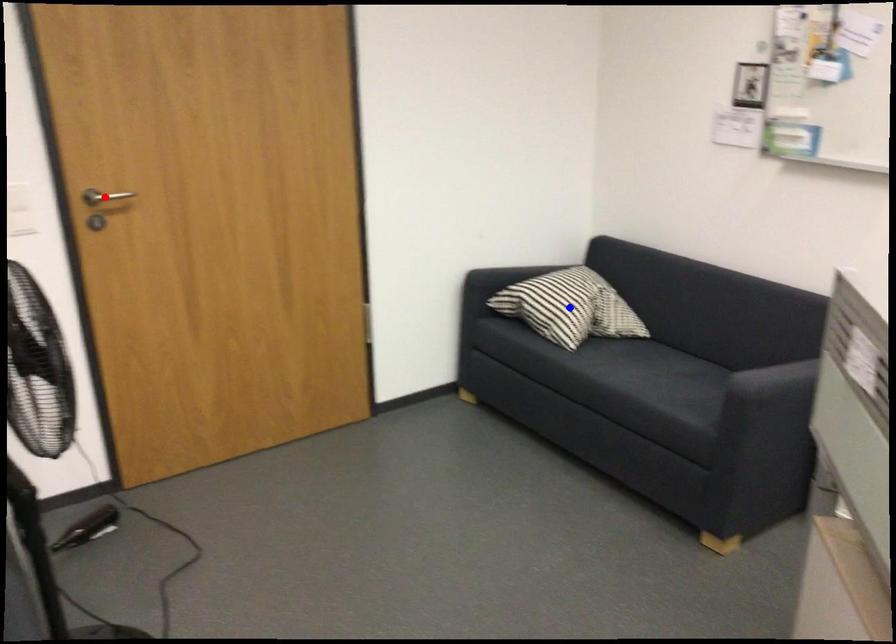
Question: In the image, two points are highlighted. Which point is nearer to the camera? Reply with the corresponding letter.

Choices:
 (A) blue point
 (B) red point

Answer: (B)